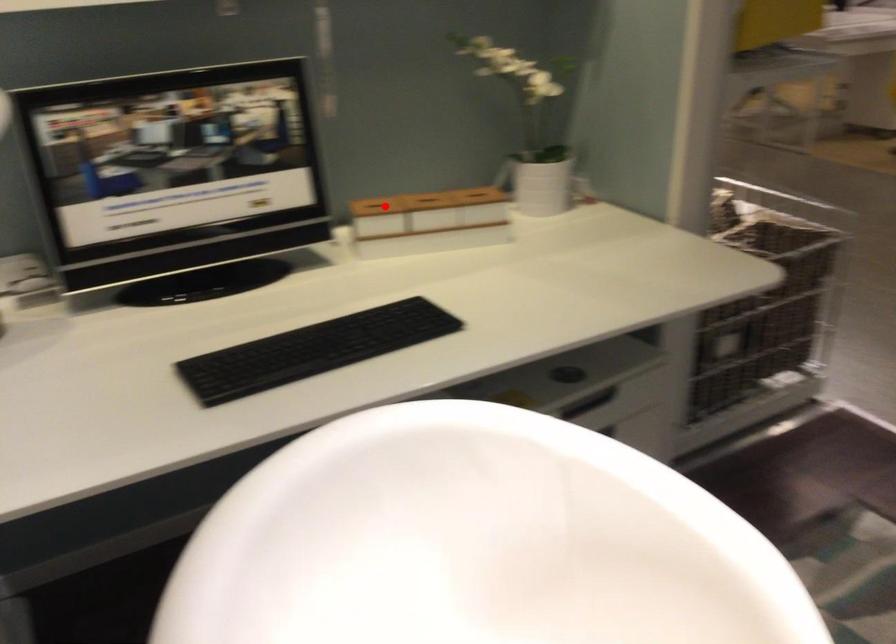
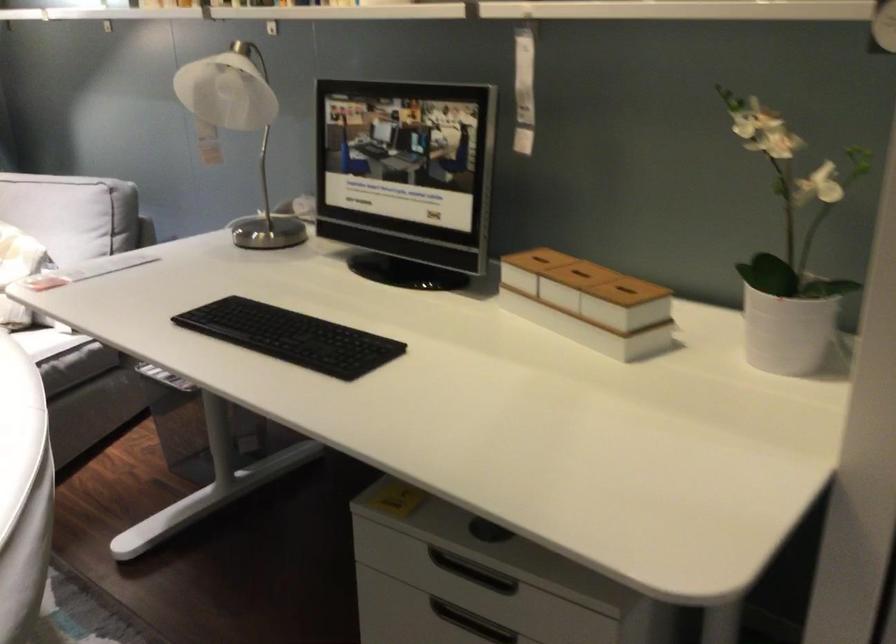
The point at the highlighted location is marked in the first image. Where is the corresponding point in the second image?

(537, 259)